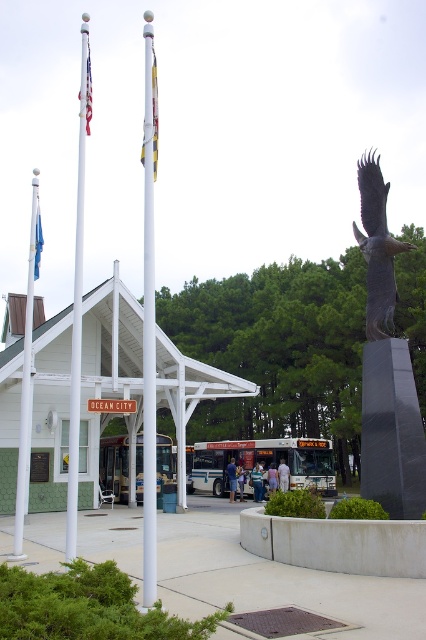
You are a city planner assessing the layout of this public space. You need to install a new bench that must be equidistant from both the black granite monument at center right and the white glossy flag pole at left. Given the distance between them, what is the minimum distance the bench should be placed from each object to meet this requirement?

The bench should be placed exactly halfway between the black granite monument at center right and the white glossy flag pole at left. Since they are 56.28 feet apart, the minimum distance from each would be 56.28 divided by 2, which is 28.14 feet.

You are a visitor at this location and want to take a photo that includes both the shiny bronze eagle at center right and the blue fabric flag at left. Which object should you place closer to the left side of your camera frame to ensure both are in the shot?

You should place the blue fabric flag at left closer to the left side of your camera frame since the shiny bronze eagle at center right is already positioned to its right in the scene.

You are standing in the square and want to take a photo of the white glossy flag pole at left without the black granite monument at center right blocking it. How should you position yourself?

Move to the side opposite of the black granite monument at center right so that the white glossy flag pole at left is no longer blocked.